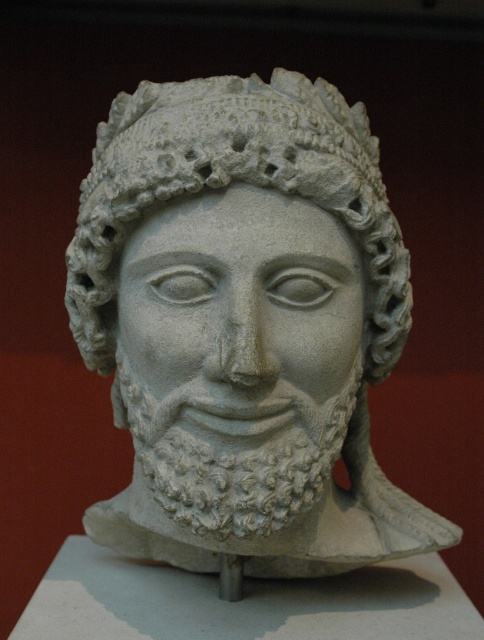
Question: Which of the following is the closest to the observer?

Choices:
 (A) white stone bust at center
 (B) white stone face at center

Answer: (B)

Question: Can you confirm if white stone bust at center is thinner than white stone face at center?

Choices:
 (A) yes
 (B) no

Answer: (B)

Question: Is white stone bust at center positioned before white stone face at center?

Choices:
 (A) no
 (B) yes

Answer: (A)

Question: Does white stone bust at center lie in front of white stone face at center?

Choices:
 (A) no
 (B) yes

Answer: (A)